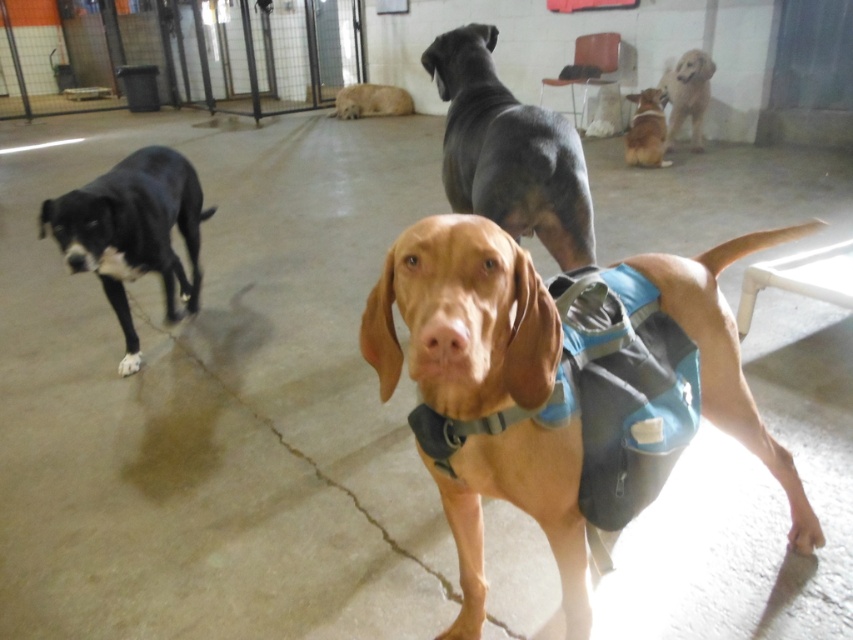
Which of these two, smooth black dog at center or light brown fur at center, stands taller?

smooth black dog at center

Does point (502, 132) come in front of point (397, 88)?

Yes.

This screenshot has height=640, width=853. In order to click on smooth black dog at center in this screenshot , I will do `click(508, 150)`.

The height and width of the screenshot is (640, 853). What do you see at coordinates (561, 387) in the screenshot? I see `brown fabric dog at center` at bounding box center [561, 387].

Does brown fabric dog at center have a greater height compared to light brown fur at center?

Indeed, brown fabric dog at center has a greater height compared to light brown fur at center.

The image size is (853, 640). Find the location of `brown fabric dog at center`. brown fabric dog at center is located at coordinates (561, 387).

Find the location of a particular element. The image size is (853, 640). brown fabric dog at center is located at coordinates (561, 387).

Is brown fabric dog at center positioned before brown suede dog at upper center?

Yes, it is in front of brown suede dog at upper center.

Can you confirm if brown fabric dog at center is thinner than brown suede dog at upper center?

Incorrect, brown fabric dog at center's width is not less than brown suede dog at upper center's.

The height and width of the screenshot is (640, 853). Identify the location of brown fabric dog at center. (561, 387).

Locate an element on the screen. The width and height of the screenshot is (853, 640). brown fabric dog at center is located at coordinates (561, 387).